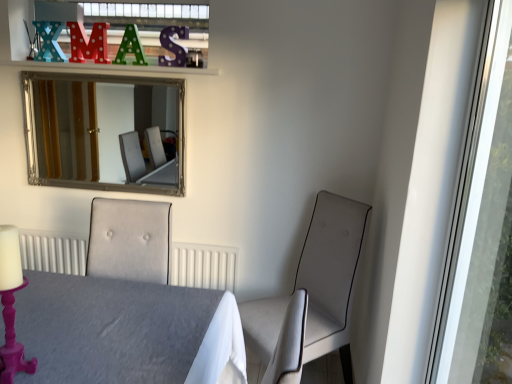
Question: Does point (135, 57) appear closer or farther from the camera than point (36, 21)?

Choices:
 (A) closer
 (B) farther

Answer: (A)

Question: Considering the positions of green polka dot letter a at upper center, the third alphabet in the left-to-right sequence, and teal felt letter x at upper left, which is the 3th alphabet from right to left, in the image, is green polka dot letter a at upper center, the third alphabet in the left-to-right sequence, wider or thinner than teal felt letter x at upper left, which is the 3th alphabet from right to left,?

Choices:
 (A) wide
 (B) thin

Answer: (A)

Question: Based on their relative distances, which object is farther from the polka dot wooden letter m at upper center, which is the 2th alphabet in right-to-left order?

Choices:
 (A) silver/glass mirror at upper left
 (B) smooth gray table at center
 (C) green polka dot letter a at upper center, which appears as the 1th alphabet when viewed from the right
 (D) pink painted wood candle holder at lower left
 (E) suede-like beige chair at right

Answer: (A)

Question: Which is farther from the green polka dot letter a at upper center, the third alphabet in the left-to-right sequence?

Choices:
 (A) pink painted wood candle holder at lower left
 (B) suede-like beige chair at right
 (C) polka dot wooden letter m at upper center, which is the 2th alphabet in right-to-left order
 (D) silver/glass mirror at upper left
 (E) transparent glass window at right

Answer: (D)